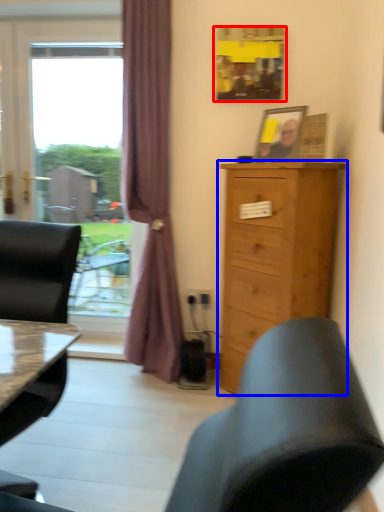
Question: Which of the following is the closest to the observer, picture frame (highlighted by a red box) or chest of drawers (highlighted by a blue box)?

Choices:
 (A) picture frame
 (B) chest of drawers

Answer: (B)